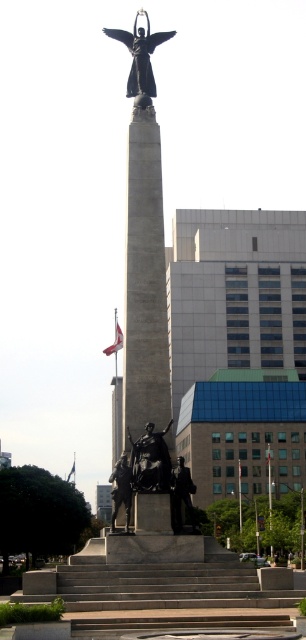
Is polished bronze statue at upper center shorter than bronze statue at center?

Indeed, polished bronze statue at upper center has a lesser height compared to bronze statue at center.

You are a GUI agent. You are given a task and a screenshot of the screen. Output one action in this format:
    pyautogui.click(x=<x>, y=<y>)
    Task: Click on the polished bronze statue at upper center
    
    Given the screenshot: What is the action you would take?
    pyautogui.click(x=140, y=58)